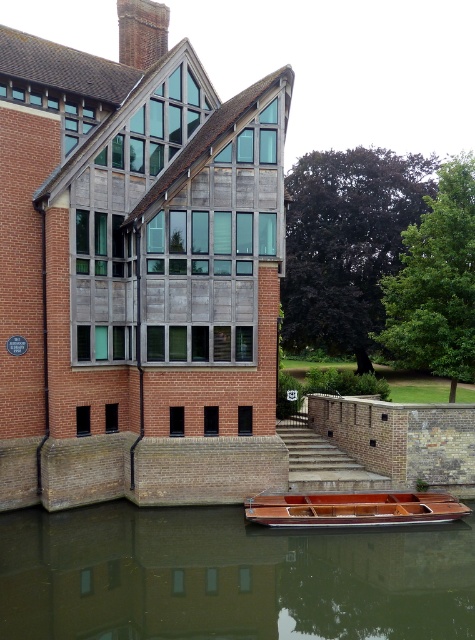
The width and height of the screenshot is (475, 640). What do you see at coordinates (228, 577) in the screenshot?
I see `brown wooden boat at lower center` at bounding box center [228, 577].

Who is shorter, brown wooden boat at lower center or wooden boat at lower center?

Standing shorter between the two is wooden boat at lower center.

Which is behind, point (352, 605) or point (267, 513)?

The point (267, 513) is more distant.

Where is `brown wooden boat at lower center`? This screenshot has width=475, height=640. brown wooden boat at lower center is located at coordinates (228, 577).